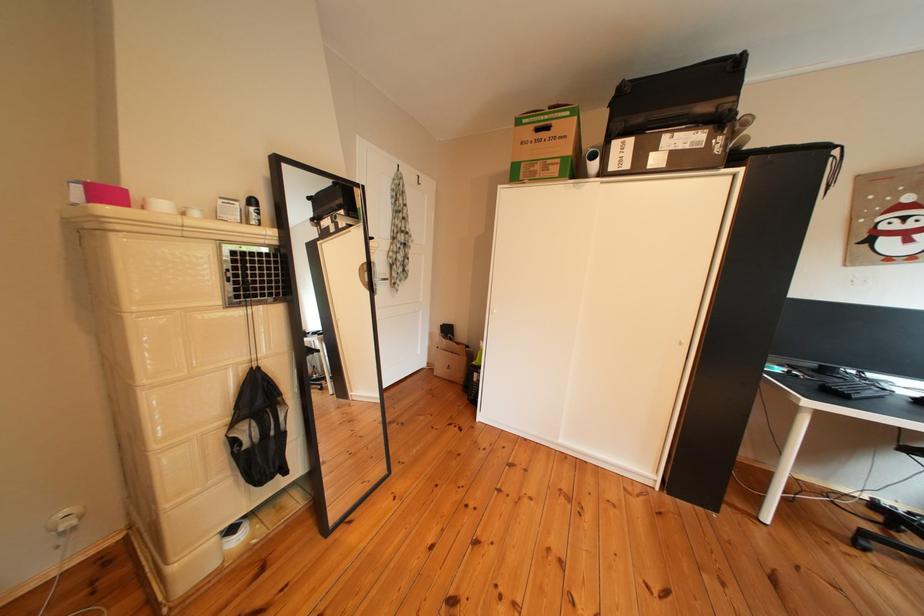
Where is `pink box`? The image size is (924, 616). pink box is located at coordinates (105, 193).